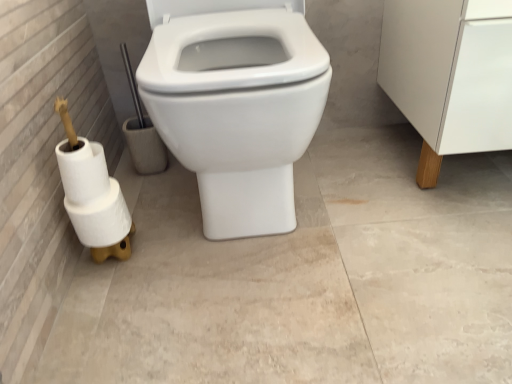
The image size is (512, 384). Find the location of `free area behind white matte toilet paper at left, which ranks as the second toilet paper in bottom-to-top order`. free area behind white matte toilet paper at left, which ranks as the second toilet paper in bottom-to-top order is located at coordinates (153, 210).